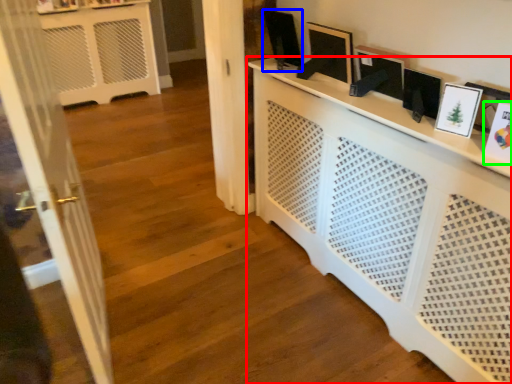
Question: Which object is positioned farthest from furniture (highlighted by a red box)? Select from picture frame (highlighted by a blue box) and picture frame (highlighted by a green box).

Choices:
 (A) picture frame
 (B) picture frame

Answer: (A)